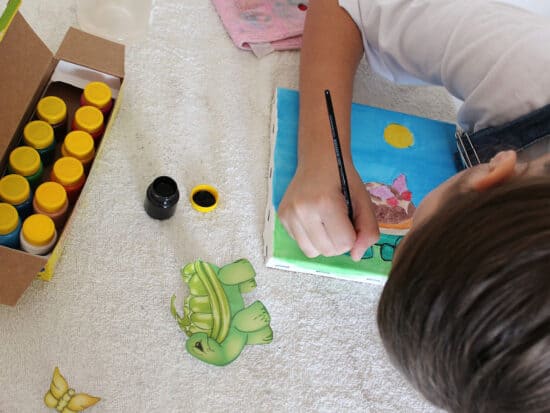
I want to click on green turtle sticker, so click(x=221, y=310).